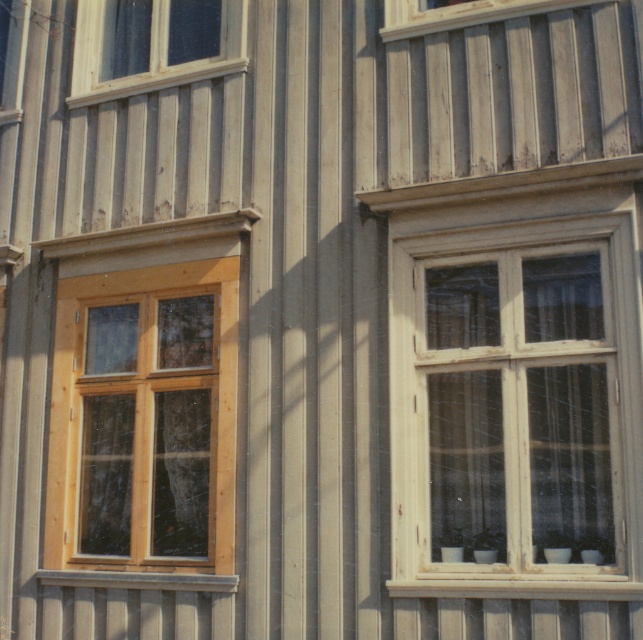
You are an architect assessing the facade of a building. You notice two wooden windows, the wooden window at center and the wooden window at upper center. Which one has a larger size?

The wooden window at center is bigger than the wooden window at upper center.

You are standing in front of the wooden building facade and notice two windows at the upper left. According to the scene, which window is positioned more to the right between the matte wood window at upper left and the wooden window at upper left?

The matte wood window at upper left is positioned more to the right than the wooden window at upper left.

Based on the scene description, which window at the upper left has a larger size between the matte wood window at upper left and the wooden window at upper left?

The matte wood window at upper left has a larger size compared to the wooden window at upper left.